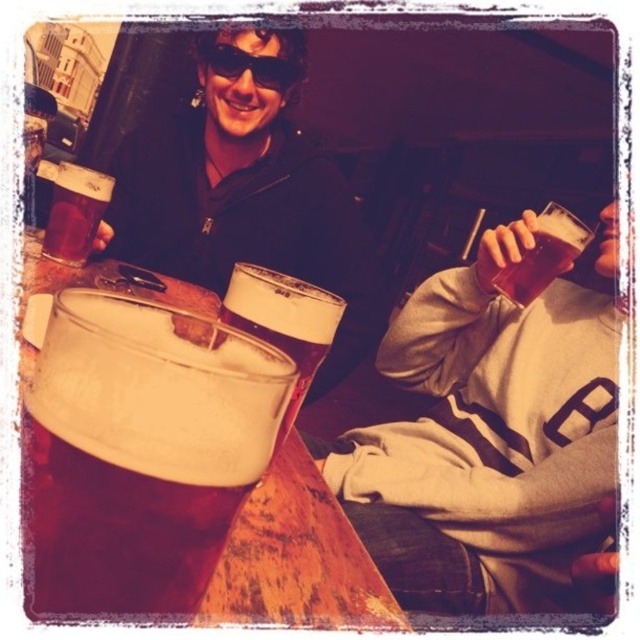
You are a photographer trying to capture a closeup of the translucent glass at left without the matte black jacket at upper center blocking the view. Is this possible given their positions?

The matte black jacket at upper center is further to the viewer than the translucent glass at left, so it would block the view of the translucent glass at left. Therefore, capturing a closeup without the jacket blocking is not possible.

You are a bartender who needs to place a new drink order between the brown frothy beer at lower left and the translucent glass mug at center. Given that the space between them is 6.07 inches, can you fit a standard 3.5 inch wide cocktail glass in that space?

The space between the brown frothy beer at lower left and the translucent glass mug at center is 6.07 inches. A standard 3.5 inch wide cocktail glass would fit since 3.5 inches is less than 6.07 inches.